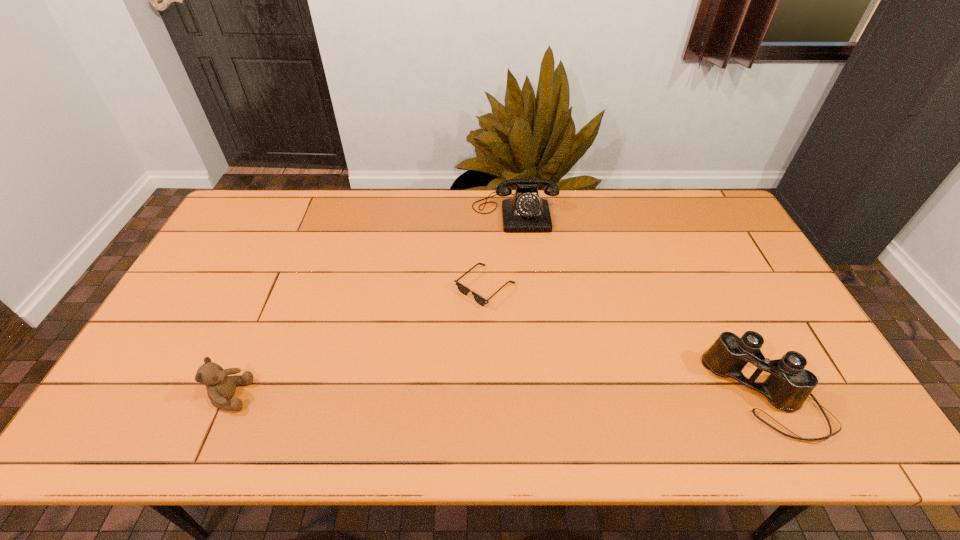
Identify the location of free spot at the left edge of the desktop. (223, 255).

In the image, there is a desktop. Where is `vacant space at the right edge`? This screenshot has width=960, height=540. vacant space at the right edge is located at coordinates [806, 359].

You are a GUI agent. You are given a task and a screenshot of the screen. Output one action in this format:
    pyautogui.click(x=<x>, y=<y>)
    Task: Click on the free space at the far right corner of the desktop
    
    Given the screenshot: What is the action you would take?
    pyautogui.click(x=686, y=193)

Where is `free spot between the telephone and the rightmost object`? This screenshot has height=540, width=960. free spot between the telephone and the rightmost object is located at coordinates (641, 304).

Find the location of a particular element. vacant space that's between the telephone and the teddy bear is located at coordinates (372, 304).

Identify the location of vacant area that lies between the rightmost object and the leftmost object. (499, 396).

You are a GUI agent. You are given a task and a screenshot of the screen. Output one action in this format:
    pyautogui.click(x=<x>, y=<y>)
    Task: Click on the vacant area between the rightmost object and the sunglasses
    The width and height of the screenshot is (960, 540).
    Given the screenshot: What is the action you would take?
    pyautogui.click(x=626, y=342)

The image size is (960, 540). Find the location of `free space between the teddy bear and the farthest object`. free space between the teddy bear and the farthest object is located at coordinates (372, 304).

You are a GUI agent. You are given a task and a screenshot of the screen. Output one action in this format:
    pyautogui.click(x=<x>, y=<y>)
    Task: Click on the free space between the sunglasses and the farthest object
    
    Given the screenshot: What is the action you would take?
    pyautogui.click(x=500, y=249)

Find the location of a particular element. unoccupied position between the binoculars and the sunglasses is located at coordinates click(x=626, y=342).